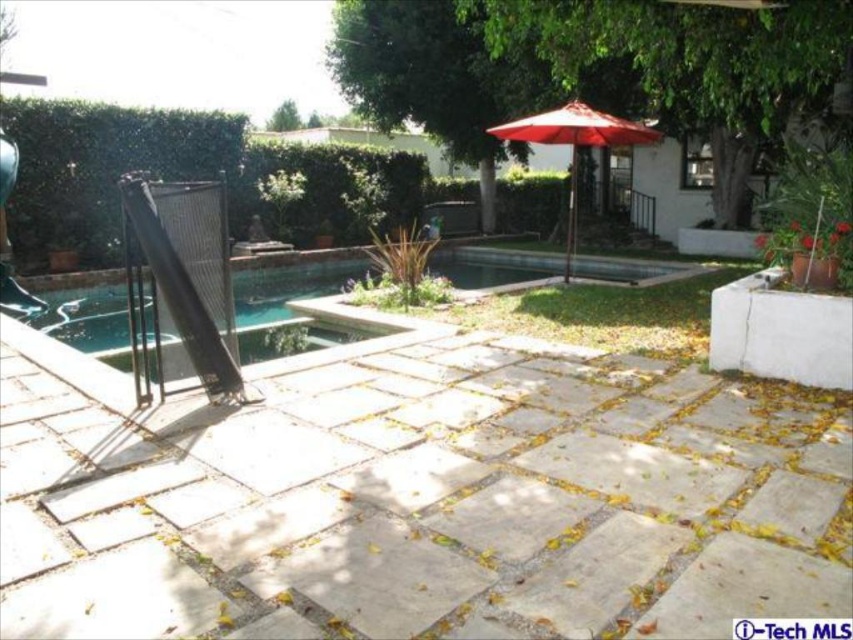
Question: Is green leafy hedge at upper left below green leafy hedge at center?

Choices:
 (A) yes
 (B) no

Answer: (B)

Question: Which object is farther from the camera taking this photo?

Choices:
 (A) blue tile swimming pool at center
 (B) green leafy hedge at center
 (C) green leafy hedge at upper left

Answer: (B)

Question: Is green leafy hedge at upper left to the left of green leafy hedge at center from the viewer's perspective?

Choices:
 (A) no
 (B) yes

Answer: (B)

Question: Estimate the real-world distances between objects in this image. Which object is closer to the blue tile swimming pool at center?

Choices:
 (A) green leafy hedge at upper left
 (B) green leafy hedge at center
 (C) red fabric umbrella at center

Answer: (C)

Question: Which is farther from the green leafy hedge at center?

Choices:
 (A) red fabric umbrella at center
 (B) green leafy hedge at upper left
 (C) blue tile swimming pool at center

Answer: (A)

Question: Is blue tile swimming pool at center further to camera compared to green leafy hedge at center?

Choices:
 (A) no
 (B) yes

Answer: (A)